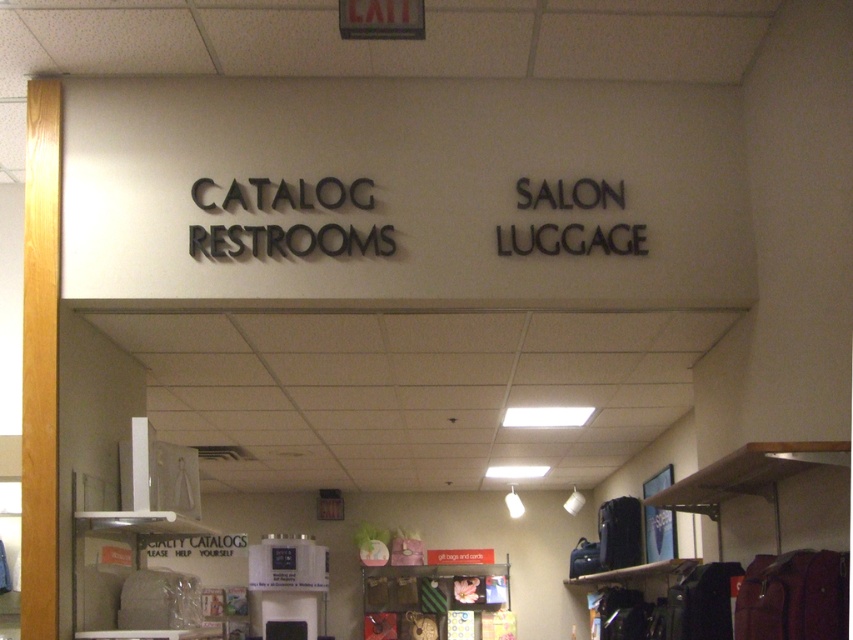
Does black matte sign at center appear on the left side of black metallic sign at upper right?

Yes, black matte sign at center is to the left of black metallic sign at upper right.

Can you confirm if black matte sign at center is wider than black metallic sign at upper right?

Indeed, black matte sign at center has a greater width compared to black metallic sign at upper right.

Is point (321, 193) more distant than point (614, 236)?

No, it is not.

Locate an element on the screen. This screenshot has height=640, width=853. black matte sign at center is located at coordinates (288, 240).

Between matte black wallet at center and black metallic sign at upper right, which one has more height?

matte black wallet at center

What do you see at coordinates (428, 595) in the screenshot? I see `matte black wallet at center` at bounding box center [428, 595].

The height and width of the screenshot is (640, 853). In order to click on matte black wallet at center in this screenshot , I will do `click(428, 595)`.

Is black matte sign at center taller than matte black wallet at center?

No.

Is black matte sign at center thinner than matte black wallet at center?

Indeed, black matte sign at center has a lesser width compared to matte black wallet at center.

Is point (393, 246) in front of point (445, 605)?

Yes.

Identify the location of black matte sign at center. The height and width of the screenshot is (640, 853). (288, 240).